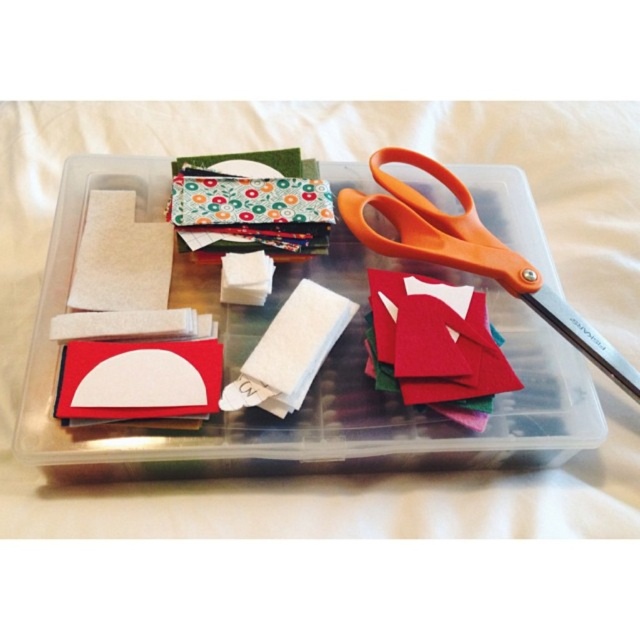
Question: Can you confirm if translucent plastic container at center is bigger than orange plastic scissors at upper right?

Choices:
 (A) yes
 (B) no

Answer: (A)

Question: Among these objects, which one is nearest to the camera?

Choices:
 (A) orange plastic scissors at upper right
 (B) translucent plastic container at center

Answer: (B)

Question: Is translucent plastic container at center to the right of orange plastic scissors at upper right from the viewer's perspective?

Choices:
 (A) yes
 (B) no

Answer: (B)

Question: Observing the image, what is the correct spatial positioning of translucent plastic container at center in reference to orange plastic scissors at upper right?

Choices:
 (A) below
 (B) above

Answer: (A)